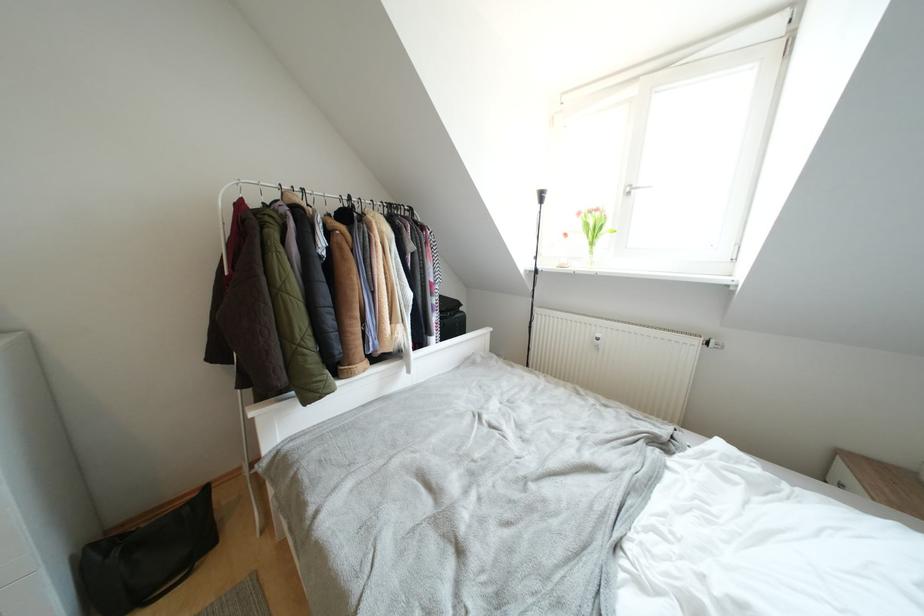
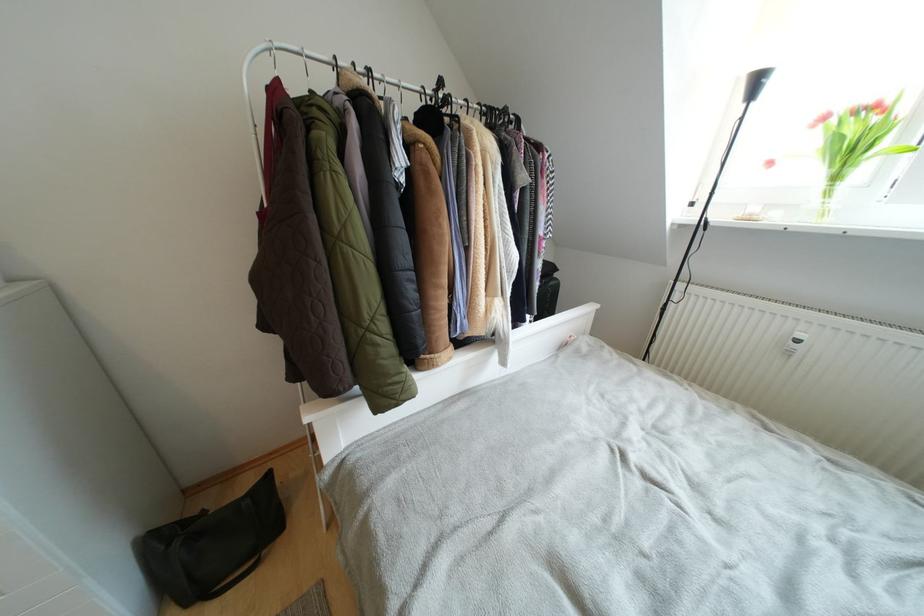
Question: Based on the continuous images, in which direction is the camera rotating? Reply with the corresponding letter.

Choices:
 (A) Left
 (B) Right
 (C) Up
 (D) Down

Answer: (A)